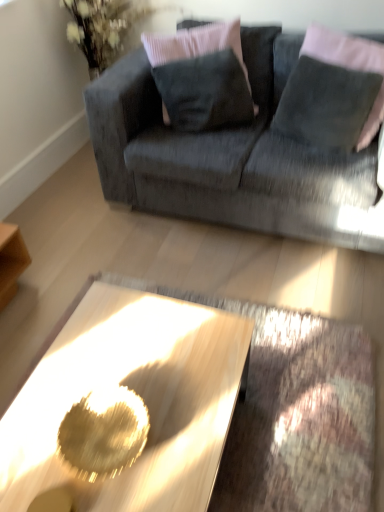
Question: From the image's perspective, does velvet dark gray pillow at upper center, which is counted as the 2th pillow, starting from the right, appear higher than metallic gold coffee table at center?

Choices:
 (A) yes
 (B) no

Answer: (A)

Question: Is velvet dark gray pillow at upper center, which is the 1th pillow in left-to-right order, behind metallic gold coffee table at center?

Choices:
 (A) yes
 (B) no

Answer: (A)

Question: Is velvet dark gray pillow at upper center, which is counted as the 2th pillow, starting from the right, directly adjacent to metallic gold coffee table at center?

Choices:
 (A) yes
 (B) no

Answer: (B)

Question: Does velvet dark gray pillow at upper center, which is counted as the 2th pillow, starting from the right, lie in front of metallic gold coffee table at center?

Choices:
 (A) yes
 (B) no

Answer: (B)

Question: From a real-world perspective, is velvet dark gray pillow at upper center, which is the 1th pillow in left-to-right order, under metallic gold coffee table at center?

Choices:
 (A) yes
 (B) no

Answer: (B)

Question: In the image, is velvet gray pillow at upper right, which is the second pillow in left-to-right order, positioned in front of or behind velvet gray couch at upper center?

Choices:
 (A) front
 (B) behind

Answer: (B)

Question: Considering the positions of velvet gray pillow at upper right, which appears as the 1th pillow when viewed from the right, and velvet gray couch at upper center in the image, is velvet gray pillow at upper right, which appears as the 1th pillow when viewed from the right, bigger or smaller than velvet gray couch at upper center?

Choices:
 (A) big
 (B) small

Answer: (B)

Question: From their relative heights in the image, would you say velvet gray pillow at upper right, which appears as the 1th pillow when viewed from the right, is taller or shorter than velvet gray couch at upper center?

Choices:
 (A) tall
 (B) short

Answer: (B)

Question: From the image's perspective, is velvet gray pillow at upper right, which is the second pillow in left-to-right order, located above or below velvet gray couch at upper center?

Choices:
 (A) above
 (B) below

Answer: (A)

Question: Considering the positions of metallic gold coffee table at center and velvet gray pillow at upper right, which appears as the 1th pillow when viewed from the right, in the image, is metallic gold coffee table at center bigger or smaller than velvet gray pillow at upper right, which appears as the 1th pillow when viewed from the right,?

Choices:
 (A) small
 (B) big

Answer: (B)

Question: From the image's perspective, is metallic gold coffee table at center located above or below velvet gray pillow at upper right, which appears as the 1th pillow when viewed from the right?

Choices:
 (A) below
 (B) above

Answer: (A)

Question: Is metallic gold coffee table at center in front of or behind velvet gray pillow at upper right, which is the second pillow in left-to-right order, in the image?

Choices:
 (A) behind
 (B) front

Answer: (B)

Question: Choose the correct answer: Is metallic gold coffee table at center inside velvet gray pillow at upper right, which appears as the 1th pillow when viewed from the right, or outside it?

Choices:
 (A) inside
 (B) outside

Answer: (B)

Question: Choose the correct answer: Is velvet gray couch at upper center inside velvet dark gray pillow at upper center, which is counted as the 2th pillow, starting from the right, or outside it?

Choices:
 (A) outside
 (B) inside

Answer: (A)

Question: From the image's perspective, is velvet gray couch at upper center positioned above or below velvet dark gray pillow at upper center, which is the 1th pillow in left-to-right order?

Choices:
 (A) above
 (B) below

Answer: (B)